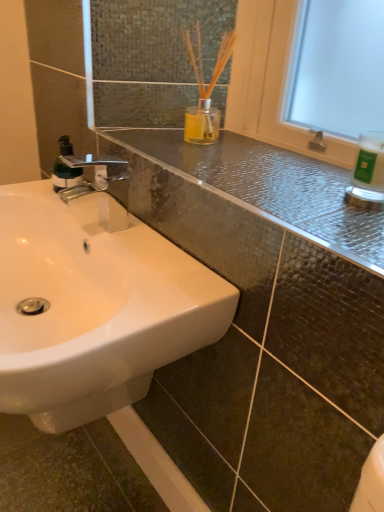
The image size is (384, 512). What do you see at coordinates (269, 187) in the screenshot?
I see `glossy ceramic counter top at upper center` at bounding box center [269, 187].

In order to click on white glossy sink at lower left in this screenshot , I will do `click(94, 307)`.

This screenshot has height=512, width=384. What do you see at coordinates (94, 307) in the screenshot?
I see `white glossy sink at lower left` at bounding box center [94, 307].

Locate an element on the screen. Image resolution: width=384 pixels, height=512 pixels. glossy ceramic counter top at upper center is located at coordinates (269, 187).

Between white glossy sink at lower left and green matte bottle at left, which one appears on the right side from the viewer's perspective?

Positioned to the right is white glossy sink at lower left.

Can you tell me how much white glossy sink at lower left and green matte bottle at left differ in facing direction?

The facing directions of white glossy sink at lower left and green matte bottle at left are 3.4 degrees apart.

Considering the sizes of objects white glossy sink at lower left and green matte bottle at left in the image provided, who is wider, white glossy sink at lower left or green matte bottle at left?

white glossy sink at lower left.

Is green matte bottle at left surrounded by white glossy sink at lower left?

No, green matte bottle at left is not a part of white glossy sink at lower left.

How far apart are white glossy sink at lower left and glossy ceramic counter top at upper center?

white glossy sink at lower left is 9.51 inches from glossy ceramic counter top at upper center.

From the image's perspective, which one is positioned higher, white glossy sink at lower left or glossy ceramic counter top at upper center?

glossy ceramic counter top at upper center appears higher in the image.

Between white glossy sink at lower left and glossy ceramic counter top at upper center, which one has larger width?

white glossy sink at lower left is wider.

Is point (89, 372) closer or farther from the camera than point (319, 179)?

Point (89, 372) appears to be closer to the viewer than point (319, 179).

Is glossy ceramic counter top at upper center taller than white glossy sink at lower left?

In fact, glossy ceramic counter top at upper center may be shorter than white glossy sink at lower left.

Is glossy ceramic counter top at upper center situated inside white glossy sink at lower left or outside?

glossy ceramic counter top at upper center is not enclosed by white glossy sink at lower left.

Between glossy ceramic counter top at upper center and white glossy sink at lower left, which one appears on the right side from the viewer's perspective?

From the viewer's perspective, glossy ceramic counter top at upper center appears more on the right side.

Where is `sink below the glossy ceramic counter top at upper center (from a real-world perspective)`? sink below the glossy ceramic counter top at upper center (from a real-world perspective) is located at coordinates (94, 307).

Can you confirm if white glossy bottle at upper right is bigger than glossy ceramic counter top at upper center?

No, white glossy bottle at upper right is not bigger than glossy ceramic counter top at upper center.

Is white glossy bottle at upper right beside glossy ceramic counter top at upper center?

There is a gap between white glossy bottle at upper right and glossy ceramic counter top at upper center.

Is point (382, 166) farther from viewer compared to point (215, 170)?

No, it is not.

Based on the photo, who is more distant, white glossy bottle at upper right or glossy ceramic counter top at upper center?

white glossy bottle at upper right.

Is glossy ceramic counter top at upper center located within green matte bottle at left?

Definitely not — glossy ceramic counter top at upper center is not inside green matte bottle at left.

This screenshot has height=512, width=384. In order to click on mouthwash below the glossy ceramic counter top at upper center (from a real-world perspective) in this screenshot , I will do `click(65, 176)`.

Are green matte bottle at left and glossy ceramic counter top at upper center located far from each other?

They are positioned close to each other.

Is point (62, 165) closer to viewer compared to point (325, 228)?

No, it is behind (325, 228).

Image resolution: width=384 pixels, height=512 pixels. Find the location of `bottle lying below the green matte bottle at left (from the image's perspective)`. bottle lying below the green matte bottle at left (from the image's perspective) is located at coordinates (368, 173).

Which is behind, white glossy bottle at upper right or green matte bottle at left?

Positioned behind is green matte bottle at left.

From the picture: Is green matte bottle at left in front of or behind white glossy sink at lower left in the image?

green matte bottle at left is behind white glossy sink at lower left.

Looking at this image, between green matte bottle at left and white glossy sink at lower left, which one has smaller width?

With smaller width is green matte bottle at left.

From the image's perspective, relative to white glossy sink at lower left, is green matte bottle at left above or below?

Clearly, from the image's perspective, green matte bottle at left is above white glossy sink at lower left.

Is white glossy sink at lower left completely or partially inside green matte bottle at left?

No, white glossy sink at lower left is not surrounded by green matte bottle at left.

Find the location of `mouthwash that is on the left side of white glossy sink at lower left`. mouthwash that is on the left side of white glossy sink at lower left is located at coordinates (65, 176).

This screenshot has width=384, height=512. Identify the location of sink below the glossy ceramic counter top at upper center (from a real-world perspective). (94, 307).

Estimate the real-world distances between objects in this image. Which object is further from glossy ceramic counter top at upper center, white glossy bottle at upper right or white glossy sink at lower left?

white glossy sink at lower left.

From the image, which object appears to be farther from white glossy bottle at upper right, green matte bottle at left or glossy ceramic counter top at upper center?

green matte bottle at left lies further to white glossy bottle at upper right than the other object.

Which object lies further to the anchor point white glossy bottle at upper right, white glossy sink at lower left or glossy ceramic counter top at upper center?

white glossy sink at lower left lies further to white glossy bottle at upper right than the other object.

Estimate the real-world distances between objects in this image. Which object is further from green matte bottle at left, glossy ceramic counter top at upper center or white glossy bottle at upper right?

white glossy bottle at upper right is further to green matte bottle at left.

Based on their spatial positions, is white glossy sink at lower left or white glossy bottle at upper right further from green matte bottle at left?

Based on the image, white glossy bottle at upper right appears to be further to green matte bottle at left.

When comparing their distances from glossy ceramic counter top at upper center, does white glossy bottle at upper right or green matte bottle at left seem closer?

white glossy bottle at upper right is closer to glossy ceramic counter top at upper center.

Considering their positions, is white glossy sink at lower left positioned closer to white glossy bottle at upper right than green matte bottle at left?

white glossy sink at lower left is positioned closer to the anchor white glossy bottle at upper right.

When comparing their distances from white glossy sink at lower left, does glossy ceramic counter top at upper center or white glossy bottle at upper right seem further?

Among the two, white glossy bottle at upper right is located further to white glossy sink at lower left.

Where is `counter top between green matte bottle at left and white glossy bottle at upper right in the horizontal direction`? counter top between green matte bottle at left and white glossy bottle at upper right in the horizontal direction is located at coordinates (269, 187).

This screenshot has height=512, width=384. What are the coordinates of `sink situated between green matte bottle at left and white glossy bottle at upper right from left to right` in the screenshot? It's located at (94, 307).

The width and height of the screenshot is (384, 512). I want to click on counter top between white glossy sink at lower left and green matte bottle at left from front to back, so click(x=269, y=187).

At what (x,y) coordinates should I click in order to perform the action: click on counter top between white glossy sink at lower left and white glossy bottle at upper right from left to right. Please return your answer as a coordinate pair (x, y). The image size is (384, 512). Looking at the image, I should click on (269, 187).